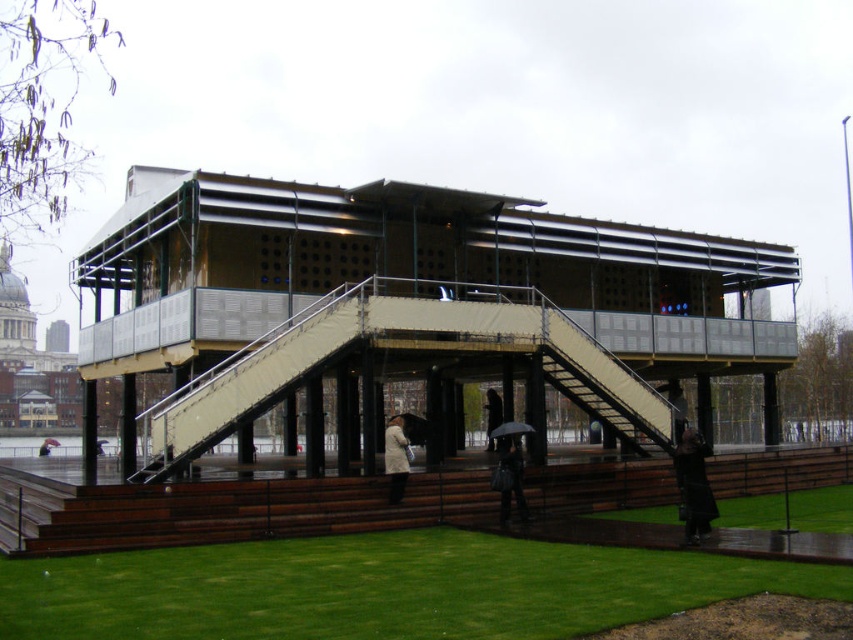
Question: Which object is positioned closest to the metallic staircase at center?

Choices:
 (A) transparent plastic umbrella at center
 (B) green lawn at lower center

Answer: (A)

Question: Which point is farther from the camera taking this photo?

Choices:
 (A) (407, 432)
 (B) (492, 388)

Answer: (B)

Question: Is the position of black leather coat at lower right less distant than that of red matte umbrella at center?

Choices:
 (A) yes
 (B) no

Answer: (A)

Question: Which object is positioned closest to the red matte umbrella at center?

Choices:
 (A) dark brown leather umbrella at lower center
 (B) black leather coat at lower right

Answer: (A)

Question: Does black leather coat at lower right appear on the left side of dark brown leather umbrella at lower center?

Choices:
 (A) yes
 (B) no

Answer: (B)

Question: Is black matte umbrella at center thinner than red matte umbrella at center?

Choices:
 (A) no
 (B) yes

Answer: (B)